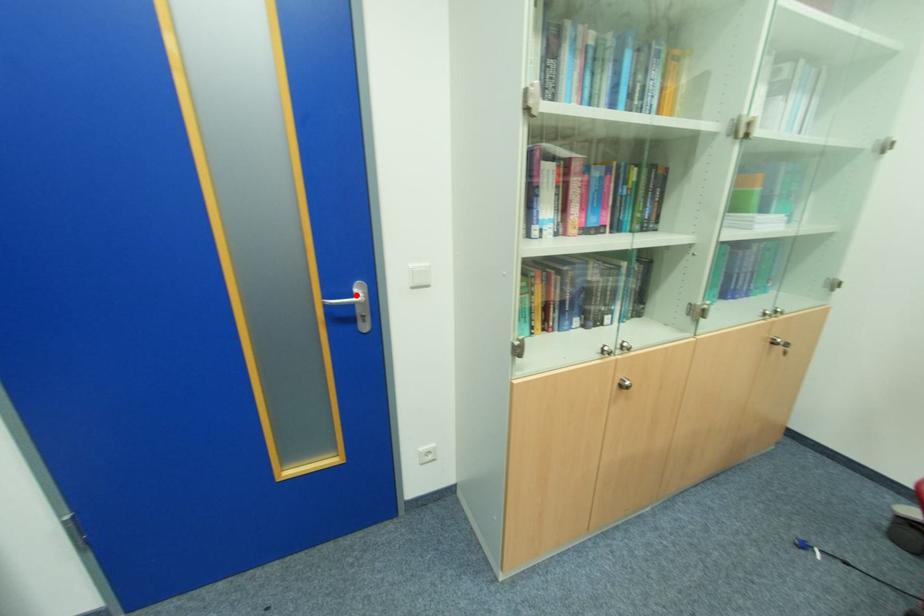
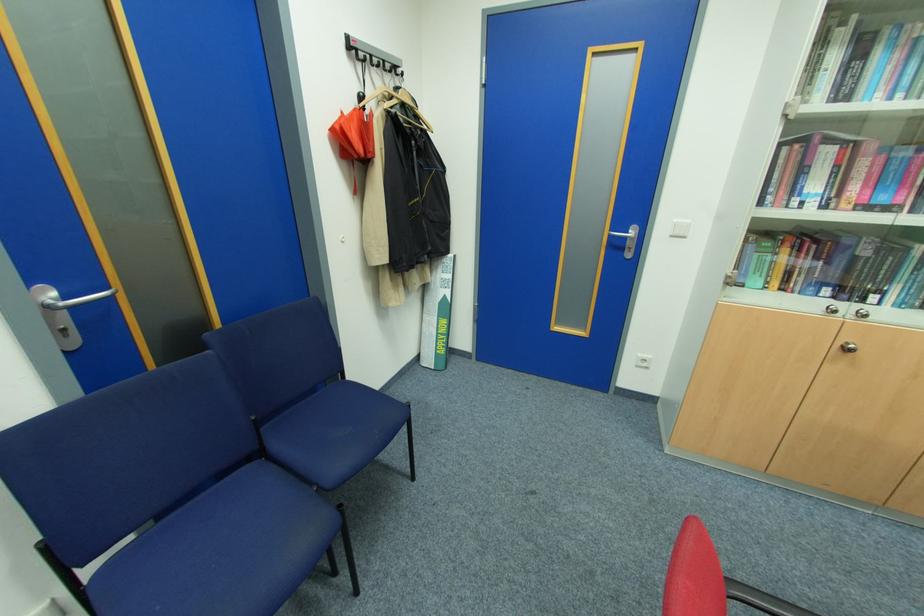
The point at the highlighted location is marked in the first image. Where is the corresponding point in the second image?

(630, 233)